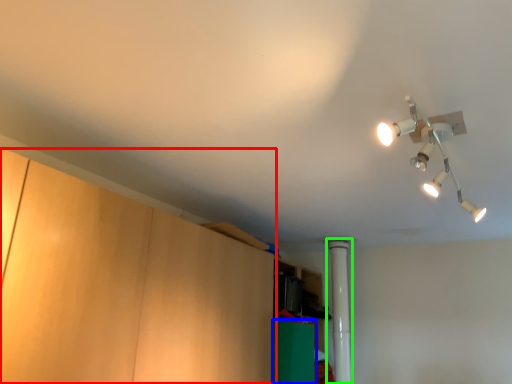
Question: Which object is positioned closest to cabinetry (highlighted by a red box)? Select from cabinetry (highlighted by a blue box) and pipe (highlighted by a green box).

Choices:
 (A) cabinetry
 (B) pipe

Answer: (A)